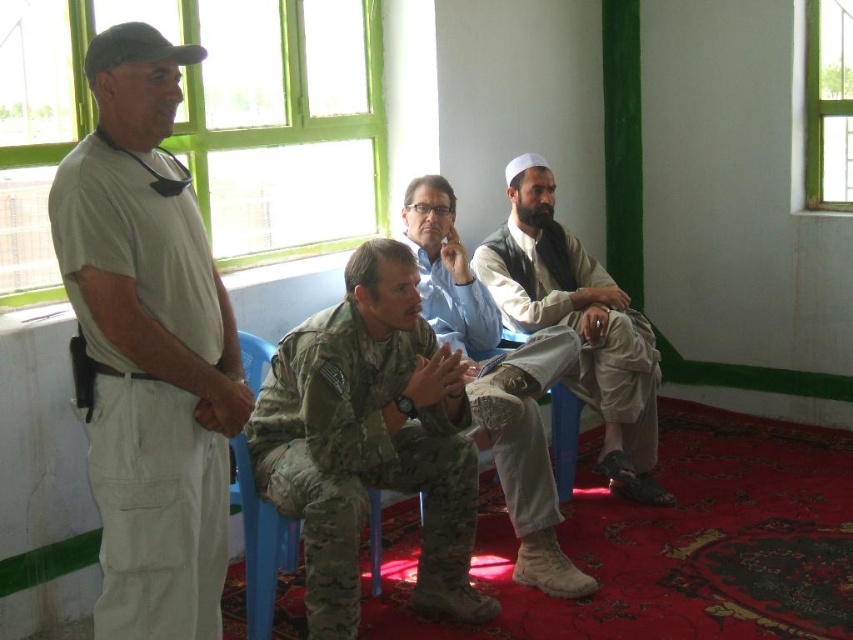
Based on the scene description, which object is shorter in height between the matte khaki uniform at left and the camouflage uniform pants at center?

The matte khaki uniform at left is shorter in height compared to the camouflage uniform pants at center.